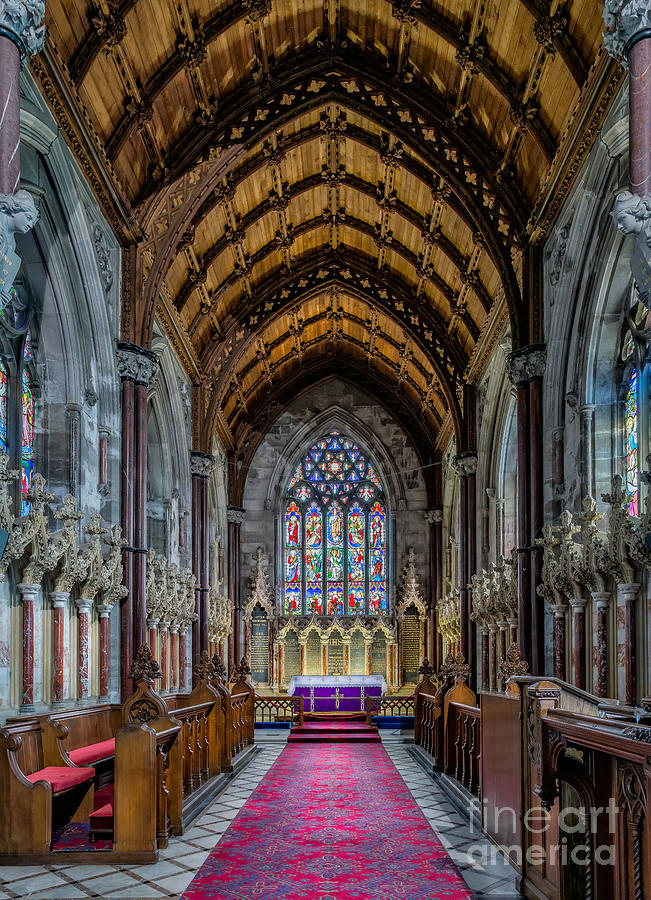
The height and width of the screenshot is (900, 651). I want to click on noses on sculptures on wall, so click(30, 223), click(618, 223).